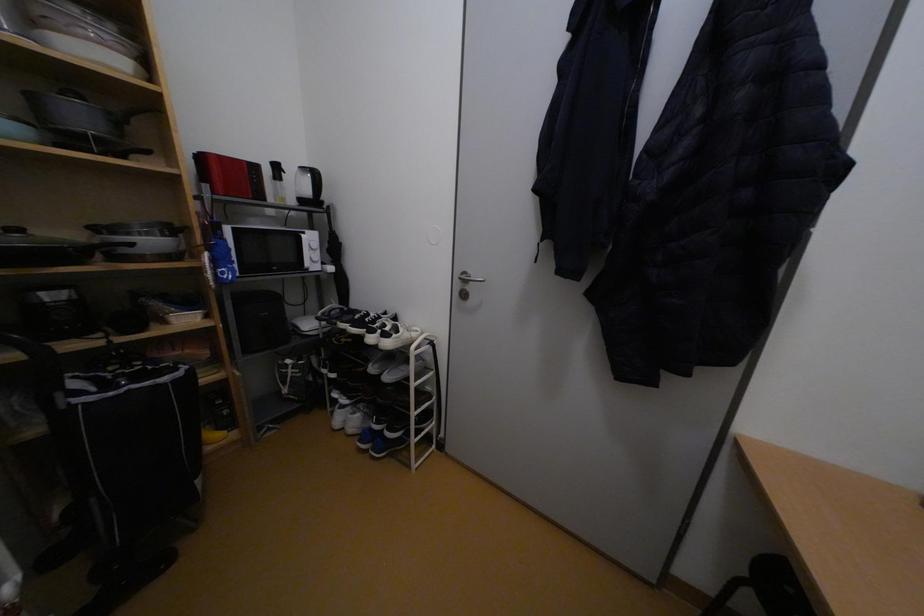
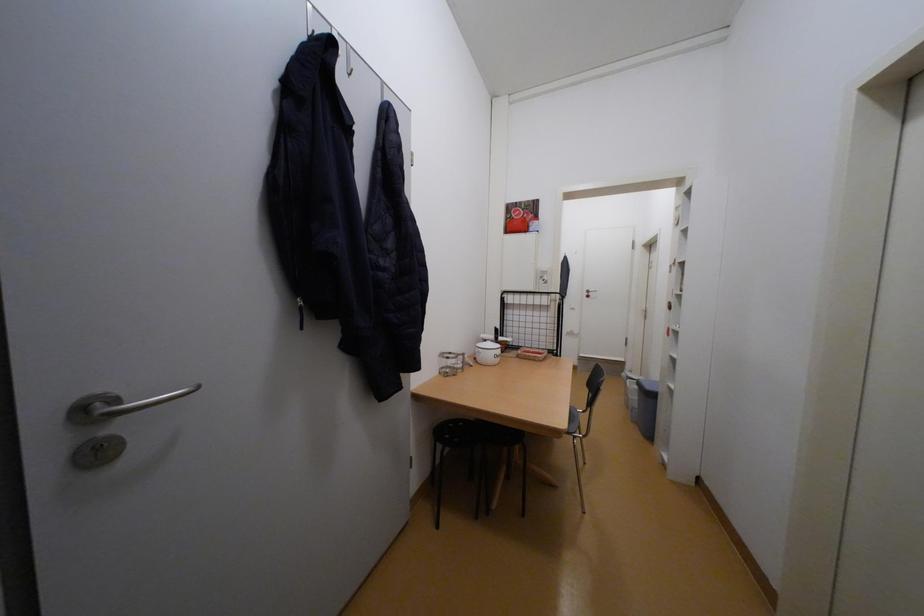
Question: Based on the continuous images, in which direction is the camera rotating? Reply with the corresponding letter.

Choices:
 (A) Left
 (B) Right
 (C) Up
 (D) Down

Answer: (B)